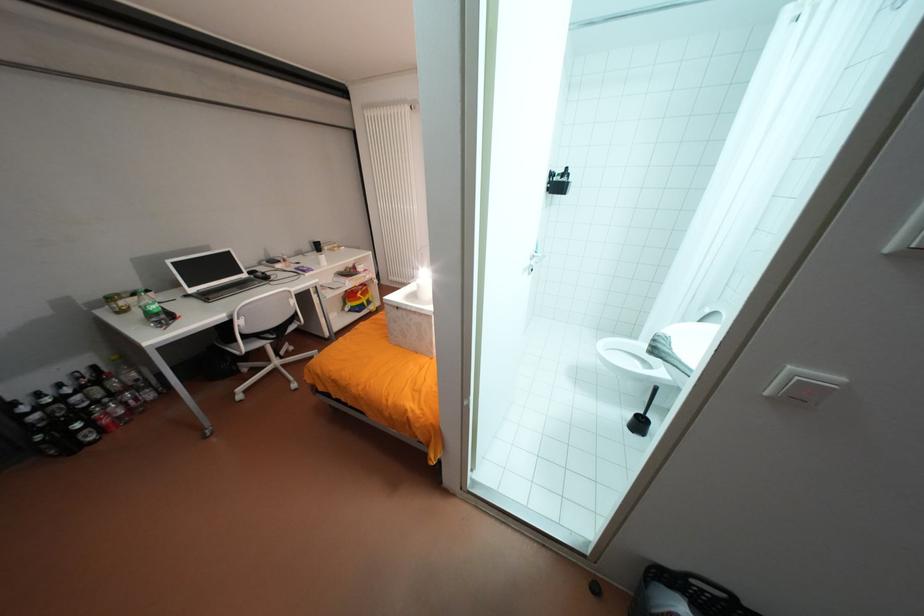
Locate an element on the screen. white toilet lid is located at coordinates (688, 342).